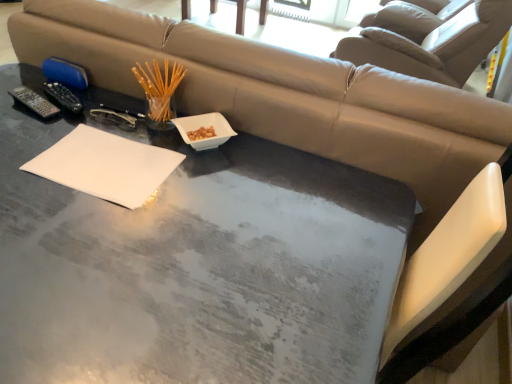
The width and height of the screenshot is (512, 384). Identify the location of vacant point to the left of white ceramic bowl at center. (139, 129).